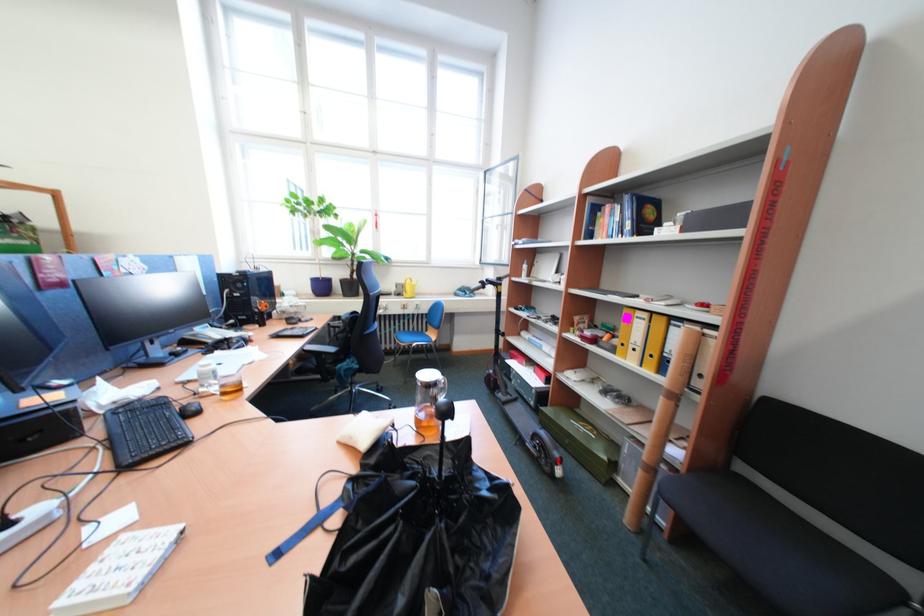
Find where to lift the purple plant pot. Please return your answer as a coordinate pair (x, y).

(321, 286)